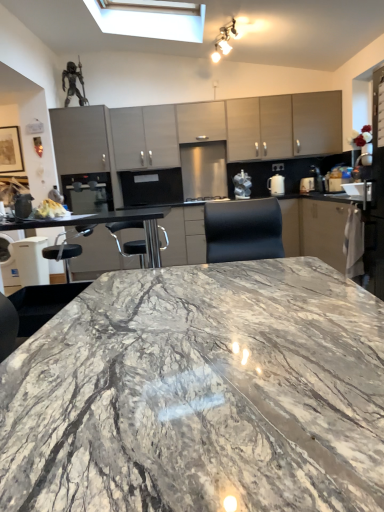
Question: In which direction should I rotate to look at matte gray cabinets at upper center, the third cabinetry in the left-to-right sequence?

Choices:
 (A) right
 (B) left

Answer: (A)

Question: Is white crumbly bread at left to the left of white glossy kettle at right, which is counted as the first appliance, starting from the right, from the viewer's perspective?

Choices:
 (A) no
 (B) yes

Answer: (B)

Question: Is white crumbly bread at left taller than white glossy kettle at right, which is counted as the first appliance, starting from the right?

Choices:
 (A) yes
 (B) no

Answer: (B)

Question: Is white crumbly bread at left aimed at white glossy kettle at right, acting as the third appliance starting from the left?

Choices:
 (A) no
 (B) yes

Answer: (A)

Question: Considering the relative sizes of white crumbly bread at left and white glossy kettle at right, which is counted as the first appliance, starting from the right, in the image provided, is white crumbly bread at left shorter than white glossy kettle at right, which is counted as the first appliance, starting from the right,?

Choices:
 (A) yes
 (B) no

Answer: (A)

Question: Is white crumbly bread at left wider than white glossy kettle at right, acting as the third appliance starting from the left?

Choices:
 (A) yes
 (B) no

Answer: (B)

Question: Considering the relative sizes of white crumbly bread at left and white glossy kettle at right, acting as the third appliance starting from the left, in the image provided, is white crumbly bread at left bigger than white glossy kettle at right, acting as the third appliance starting from the left,?

Choices:
 (A) yes
 (B) no

Answer: (B)

Question: Is matte gray cabinets at upper center, the third cabinetry in the left-to-right sequence, looking in the opposite direction of white glossy kettle at right, which is counted as the first appliance, starting from the right?

Choices:
 (A) yes
 (B) no

Answer: (B)

Question: Considering the relative positions of matte gray cabinets at upper center, which is the first cabinetry from right to left, and white glossy kettle at right, acting as the third appliance starting from the left, in the image provided, is matte gray cabinets at upper center, which is the first cabinetry from right to left, behind white glossy kettle at right, acting as the third appliance starting from the left,?

Choices:
 (A) yes
 (B) no

Answer: (B)

Question: Does matte gray cabinets at upper center, the third cabinetry in the left-to-right sequence, have a greater height compared to white glossy kettle at right, acting as the third appliance starting from the left?

Choices:
 (A) no
 (B) yes

Answer: (B)

Question: Does matte gray cabinets at upper center, which is the first cabinetry from right to left, appear on the right side of white glossy kettle at right, which is counted as the first appliance, starting from the right?

Choices:
 (A) no
 (B) yes

Answer: (B)

Question: Does matte gray cabinets at upper center, the third cabinetry in the left-to-right sequence, have a lesser width compared to white glossy kettle at right, acting as the third appliance starting from the left?

Choices:
 (A) yes
 (B) no

Answer: (B)

Question: Is white glossy kettle at right, acting as the third appliance starting from the left, inside matte gray cabinets at upper center, the third cabinetry in the left-to-right sequence?

Choices:
 (A) no
 (B) yes

Answer: (A)

Question: Does matte gray cabinets at center, the 3th cabinetry viewed from the right, have a larger size compared to satin black coffee machine at center, marked as the third appliance in a right-to-left arrangement?

Choices:
 (A) yes
 (B) no

Answer: (A)